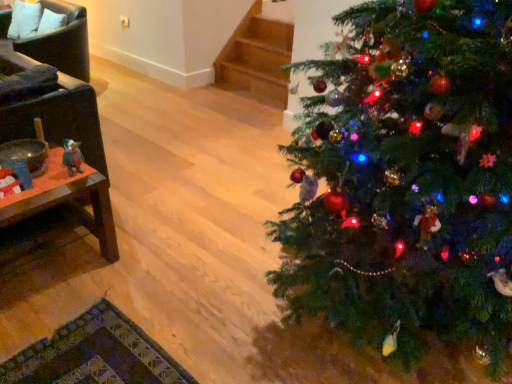
Question: Should I look upward or downward to see dark brown leather armchair at left, acting as the 1th armchair starting from the bottom?

Choices:
 (A) up
 (B) down

Answer: (A)

Question: From the image's perspective, is dark brown leather armchair at left, which appears as the 2th armchair when viewed from the top, below woodenmaterial/texturetable at left?

Choices:
 (A) yes
 (B) no

Answer: (B)

Question: Is dark brown leather armchair at left, the 1th armchair viewed from the front, not inside woodenmaterial/texturetable at left?

Choices:
 (A) yes
 (B) no

Answer: (A)

Question: Considering the relative sizes of dark brown leather armchair at left, which appears as the 2th armchair when viewed from the top, and woodenmaterial/texturetable at left in the image provided, is dark brown leather armchair at left, which appears as the 2th armchair when viewed from the top, smaller than woodenmaterial/texturetable at left?

Choices:
 (A) yes
 (B) no

Answer: (B)

Question: Is dark brown leather armchair at left, acting as the 1th armchair starting from the bottom, closer to camera compared to woodenmaterial/texturetable at left?

Choices:
 (A) yes
 (B) no

Answer: (B)

Question: Is dark brown leather armchair at left, the 1th armchair viewed from the front, facing towards woodenmaterial/texturetable at left?

Choices:
 (A) yes
 (B) no

Answer: (B)

Question: Can you confirm if dark brown leather armchair at left, the 1th armchair viewed from the front, is shorter than woodenmaterial/texturetable at left?

Choices:
 (A) no
 (B) yes

Answer: (A)

Question: Does green matte christmas tree at right have a greater height compared to green plush toy at left?

Choices:
 (A) no
 (B) yes

Answer: (B)

Question: Does green matte christmas tree at right turn towards green plush toy at left?

Choices:
 (A) no
 (B) yes

Answer: (A)

Question: From a real-world perspective, is green matte christmas tree at right located beneath green plush toy at left?

Choices:
 (A) yes
 (B) no

Answer: (B)

Question: Are green matte christmas tree at right and green plush toy at left located far from each other?

Choices:
 (A) yes
 (B) no

Answer: (A)

Question: Can you confirm if green matte christmas tree at right is smaller than green plush toy at left?

Choices:
 (A) yes
 (B) no

Answer: (B)

Question: Considering the relative positions of green matte christmas tree at right and green plush toy at left in the image provided, is green matte christmas tree at right to the right of green plush toy at left from the viewer's perspective?

Choices:
 (A) no
 (B) yes

Answer: (B)

Question: Is leather armchair at left, positioned as the first armchair in top-to-bottom order, positioned behind green matte christmas tree at right?

Choices:
 (A) no
 (B) yes

Answer: (B)